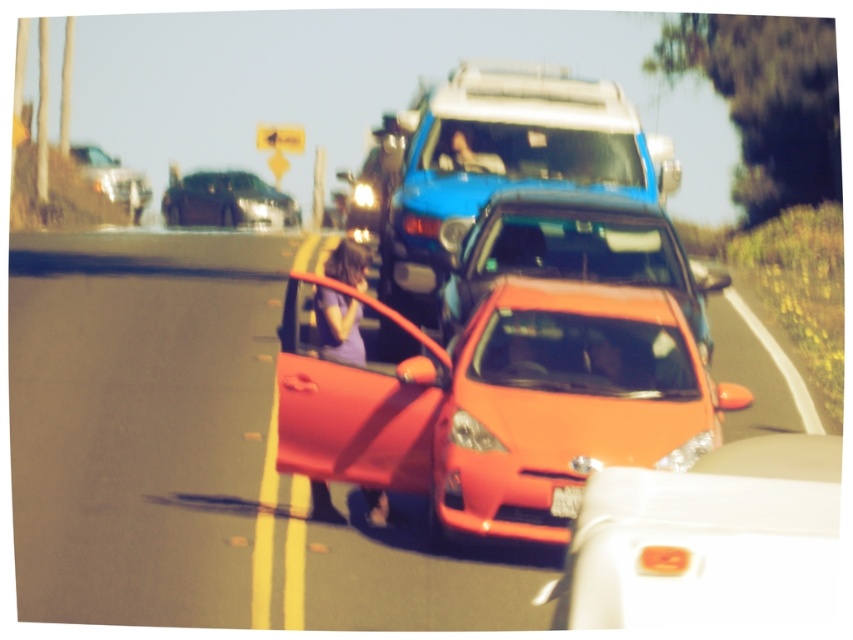
Describe the element at coordinates (575, 252) in the screenshot. I see `shiny orange sedan at center` at that location.

Is point (640, 253) more distant than point (561, 490)?

Yes.

You are a GUI agent. You are given a task and a screenshot of the screen. Output one action in this format:
    pyautogui.click(x=<x>, y=<y>)
    Task: Click on the shiny orange sedan at center
    Image resolution: width=853 pixels, height=640 pixels.
    Given the screenshot: What is the action you would take?
    (575, 252)

Who is more distant from viewer, (248, 257) or (624, 200)?

Positioned behind is point (248, 257).

Does point (741, 352) come farther from viewer compared to point (488, 269)?

That is True.

This screenshot has height=640, width=853. What are the coordinates of `shiny orange car at center` in the screenshot? It's located at (200, 458).

Is point (285, 502) closer to viewer compared to point (561, 497)?

No, (285, 502) is behind (561, 497).

How much distance is there between shiny orange car at center and white plastic license plate at center?

shiny orange car at center is 3.81 meters away from white plastic license plate at center.

Is point (206, 413) farther from camera compared to point (570, 493)?

That is True.

The image size is (853, 640). Find the location of `shiny orange car at center`. shiny orange car at center is located at coordinates (200, 458).